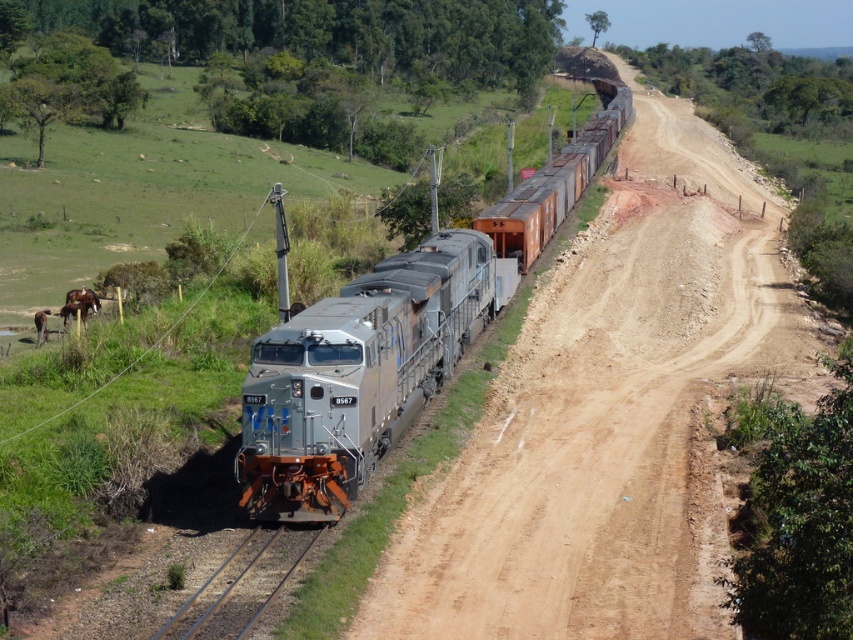
You are a photographer standing on the dirt road next to the railway track. You want to take a photo of the silver metallic train at center and the silver metallic locomotive at center. Which one will appear taller in your photo?

The silver metallic train at center will appear taller in the photo because it has a greater height compared to the silver metallic locomotive at center.